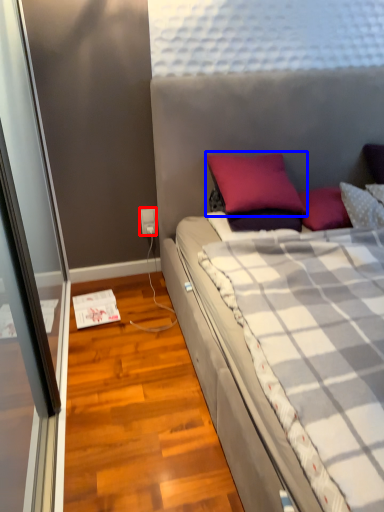
Question: Which object appears closest to the camera in this image, power outlet (highlighted by a red box) or pillow (highlighted by a blue box)?

Choices:
 (A) power outlet
 (B) pillow

Answer: (B)